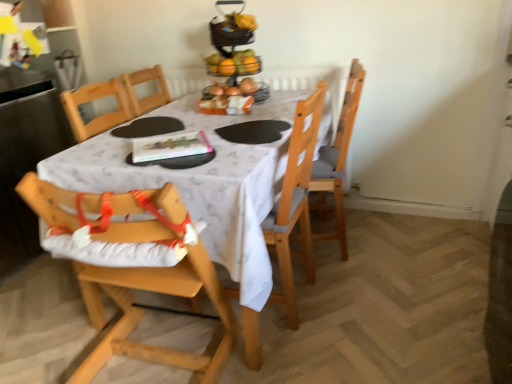
You are a GUI agent. You are given a task and a screenshot of the screen. Output one action in this format:
    pyautogui.click(x=<x>, y=<y>)
    Task: Click on the free spot above orange plastic basket at center (from a real-world perspective)
    
    Given the screenshot: What is the action you would take?
    pyautogui.click(x=226, y=89)